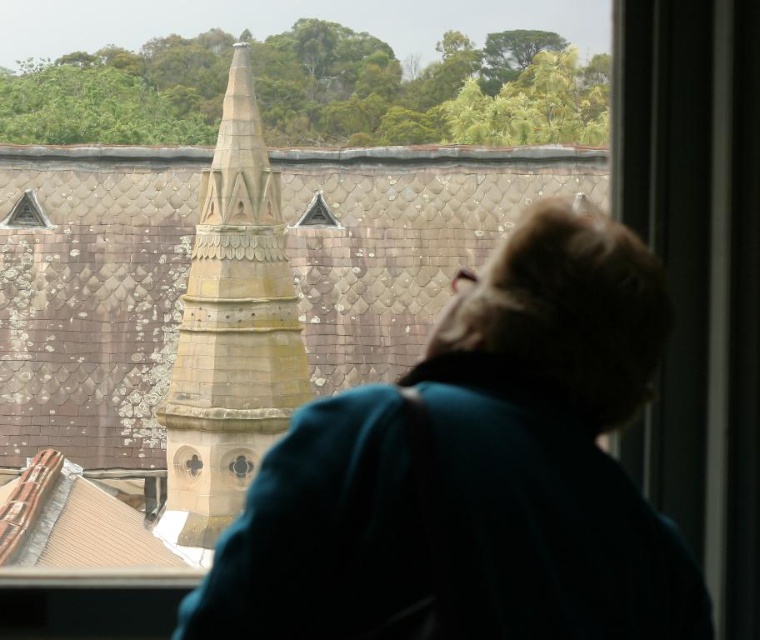
You are standing in a room and looking out through the window. You see a brown textured steeple at center and a transparent glass triangle at upper left. Which object is closer to the top of the window?

The transparent glass triangle at upper left is closer to the top of the window because it is positioned above the brown textured steeple at center.

You are a window installer assessing the space between the brown textured steeple at center and the transparent glass triangle at upper left. Can you determine which object is larger in size?

The brown textured steeple at center is bigger than the transparent glass triangle at upper left according to the description.

You are standing in a room with a window. You see a teal fabric coat at center and a transparent glass triangle at upper left. Which object is higher up in the window view?

The transparent glass triangle at upper left is higher up in the window view than the teal fabric coat at center.